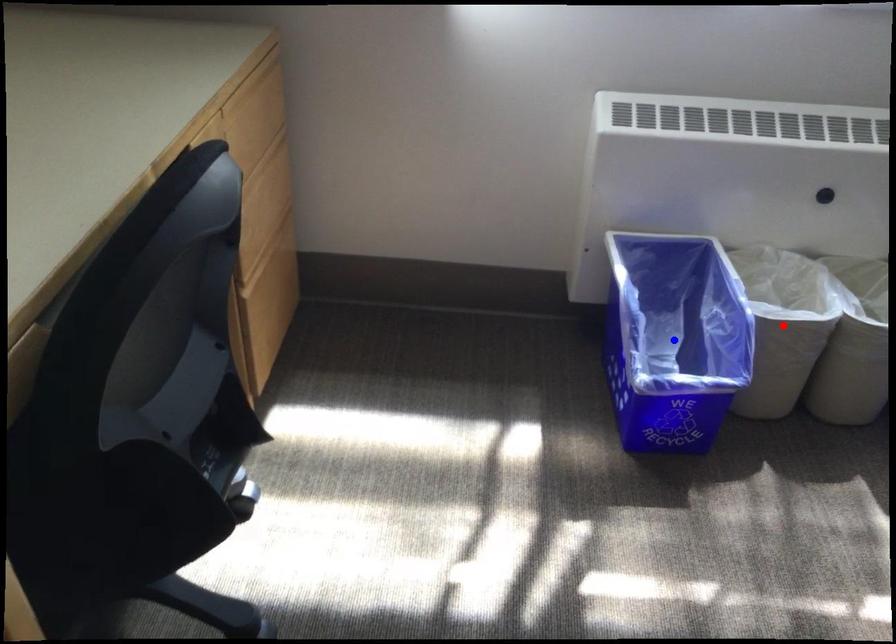
Question: In the image, two points are highlighted. Which point is nearer to the camera? Reply with the corresponding letter.

Choices:
 (A) blue point
 (B) red point

Answer: (B)